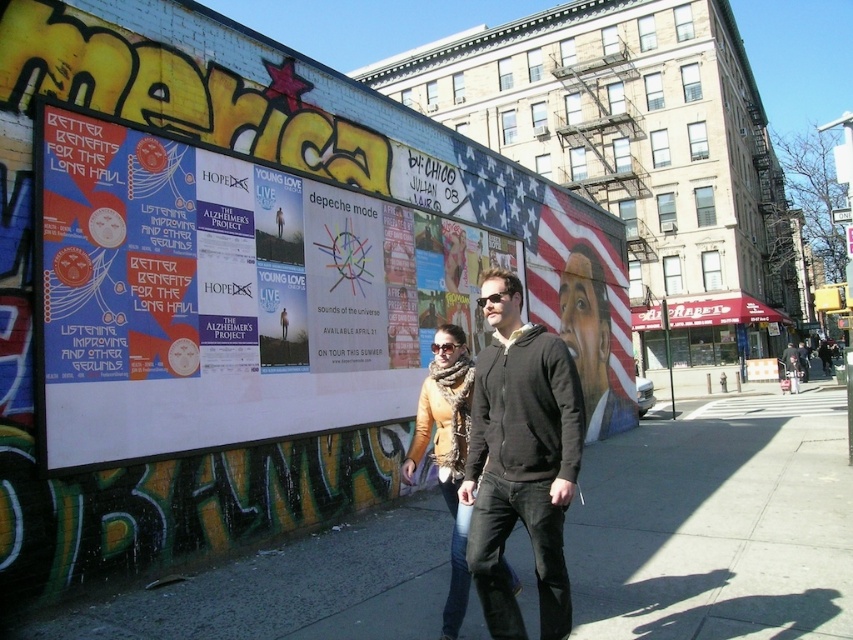
Can you confirm if white paper poster at center is positioned to the right of matte black hoodie at center?

No, white paper poster at center is not to the right of matte black hoodie at center.

The image size is (853, 640). Describe the element at coordinates (229, 296) in the screenshot. I see `white paper poster at center` at that location.

Where is `white paper poster at center`? white paper poster at center is located at coordinates (229, 296).

Does point (494, 435) come behind point (508, 572)?

No.

Between matte black hoodie at center and orange sweater at center, which one appears on the right side from the viewer's perspective?

Positioned to the right is matte black hoodie at center.

Does point (544, 499) come in front of point (419, 394)?

Yes, point (544, 499) is in front of point (419, 394).

Where is `matte black hoodie at center`? The width and height of the screenshot is (853, 640). matte black hoodie at center is located at coordinates (520, 460).

Does white paper poster at center have a greater width compared to orange sweater at center?

Yes.

Does white paper poster at center appear under orange sweater at center?

Actually, white paper poster at center is above orange sweater at center.

Who is more distant from viewer, (x=363, y=276) or (x=467, y=580)?

The point (x=363, y=276) is behind.

Find the location of a particular element. Image resolution: width=853 pixels, height=640 pixels. white paper poster at center is located at coordinates (229, 296).